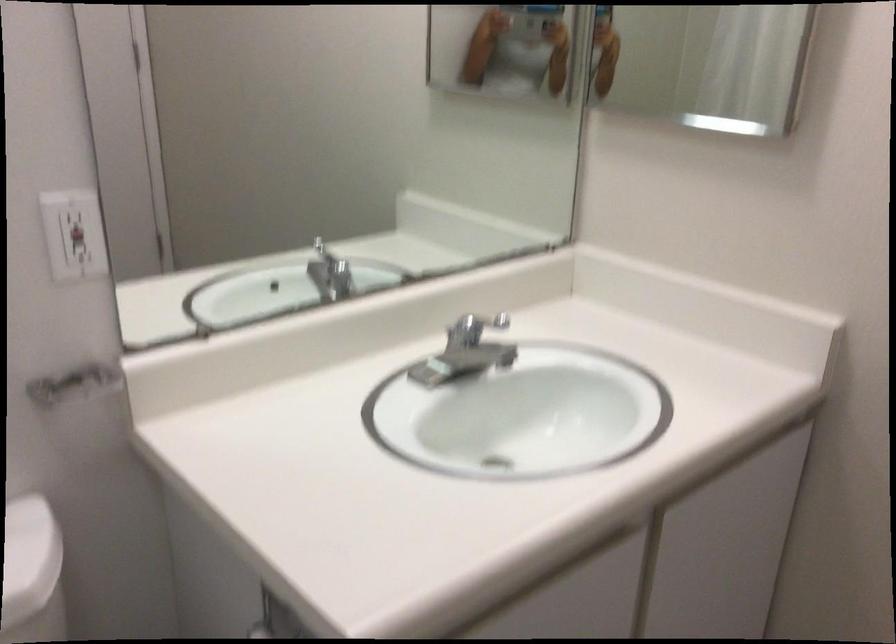
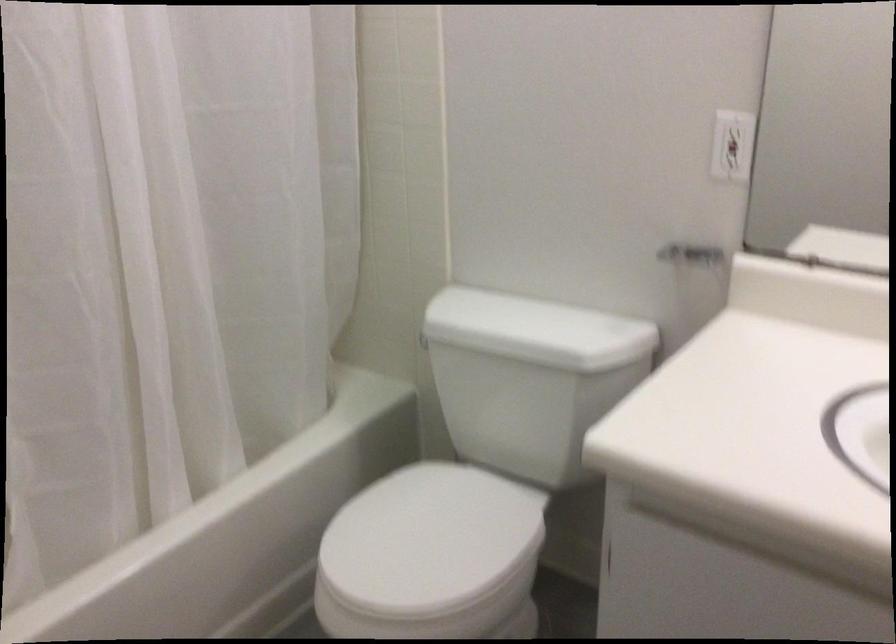
How did the camera likely rotate?

The camera's rotation is toward left-down.